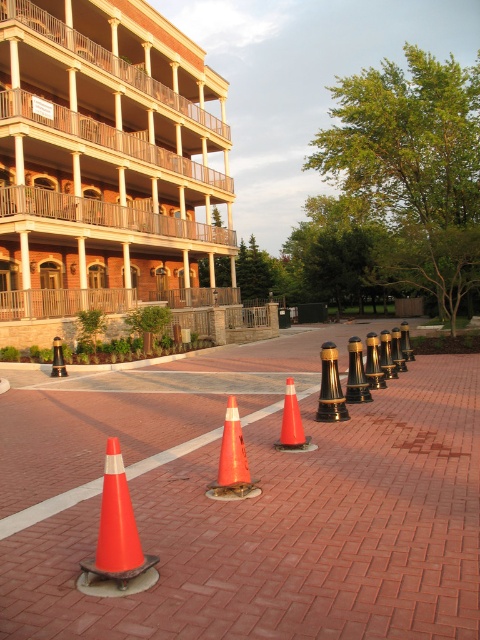
Question: Can you confirm if orange cone at center is positioned to the right of orange matte traffic cone at center?

Choices:
 (A) no
 (B) yes

Answer: (A)

Question: Among these points, which one is nearest to the camera?

Choices:
 (A) (288, 403)
 (B) (169, 460)
 (C) (132, 508)

Answer: (C)

Question: Where is orange matte/cone at center located in relation to orange matte traffic cone at center in the image?

Choices:
 (A) right
 (B) left

Answer: (B)

Question: From the image, what is the correct spatial relationship of orange matte/cone at lower left in relation to orange reflective cone at center?

Choices:
 (A) above
 (B) below

Answer: (A)

Question: Which object is positioned farthest from the orange matte traffic cone at center?

Choices:
 (A) orange matte/cone at lower left
 (B) orange matte/cone at center

Answer: (A)

Question: Which object is the farthest from the orange matte/cone at lower left?

Choices:
 (A) orange cone at center
 (B) orange matte/cone at center

Answer: (A)